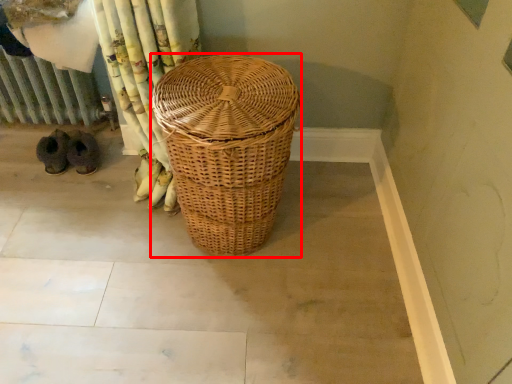
Question: From the image's perspective, where is picnic basket (annotated by the red box) located relative to radiator?

Choices:
 (A) above
 (B) below

Answer: (B)